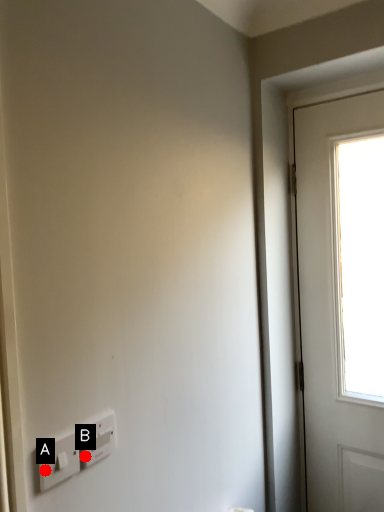
Question: Two points are circled on the image, labeled by A and B beside each circle. Which point is closer to the camera?

Choices:
 (A) A is closer
 (B) B is closer

Answer: (A)